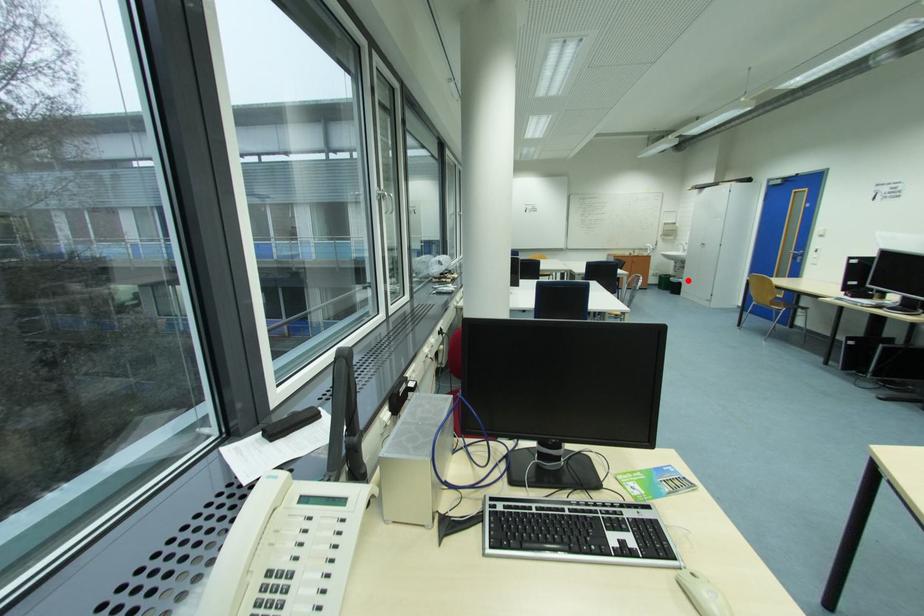
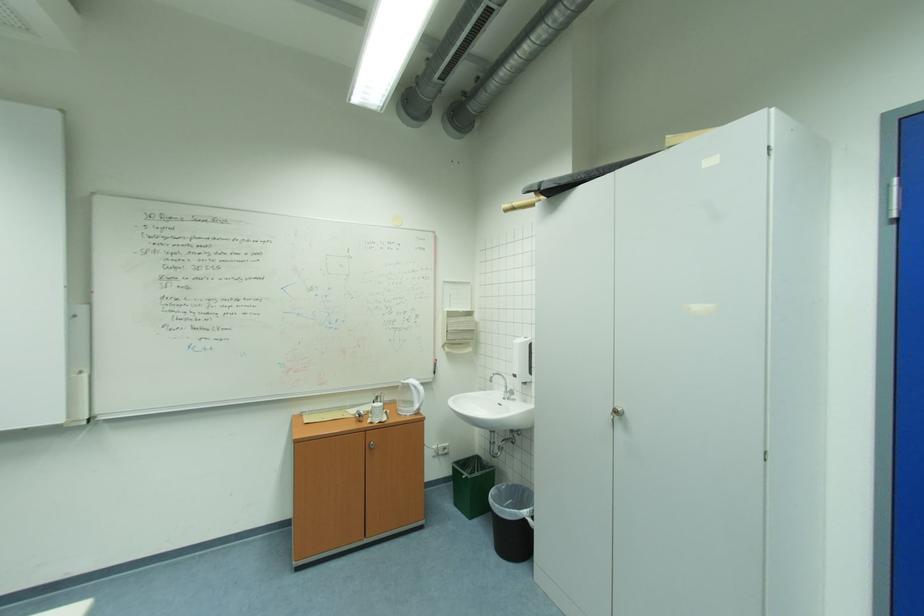
The point at the highlighted location is marked in the first image. Where is the corresponding point in the second image?

(532, 513)